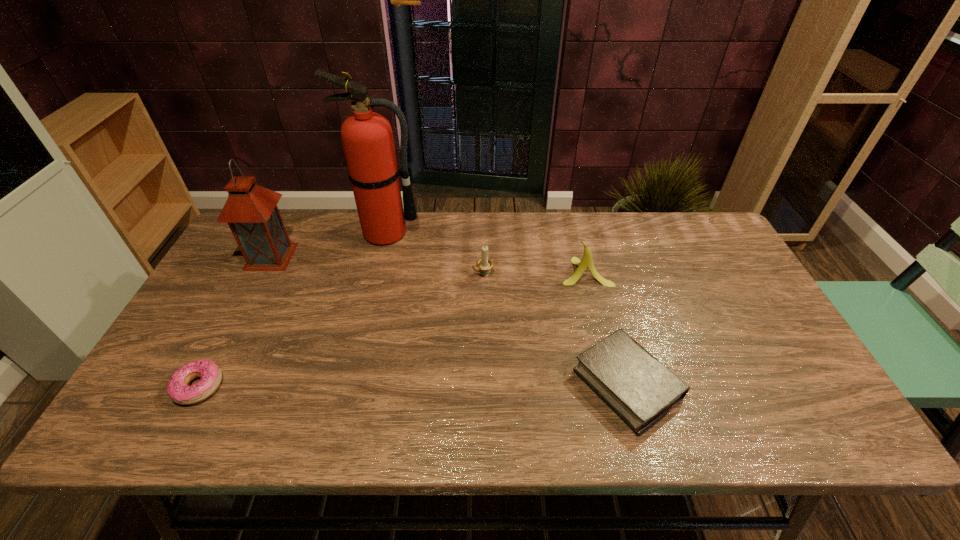
Find the location of a particular element. This screenshot has width=960, height=540. lantern at the left edge is located at coordinates (251, 211).

I want to click on doughnut that is at the left edge, so click(x=177, y=388).

Locate an element on the screen. object that is at the far left corner is located at coordinates (251, 211).

Where is `object present at the near left corner`? The image size is (960, 540). object present at the near left corner is located at coordinates (177, 388).

This screenshot has width=960, height=540. What are the coordinates of `free spot at the far edge of the desktop` in the screenshot? It's located at (555, 219).

You are a GUI agent. You are given a task and a screenshot of the screen. Output one action in this format:
    pyautogui.click(x=<x>, y=<y>)
    Task: Click on the free space at the near edge of the desktop
    The height and width of the screenshot is (540, 960).
    Given the screenshot: What is the action you would take?
    pyautogui.click(x=249, y=433)

The height and width of the screenshot is (540, 960). I want to click on vacant area at the left edge, so click(246, 284).

Image resolution: width=960 pixels, height=540 pixels. I want to click on free point at the far right corner, so click(725, 255).

Find the location of `vacant space at the near right corner of the desktop`. vacant space at the near right corner of the desktop is located at coordinates (786, 421).

Identify the location of unoccupied area between the fifth tallest object and the fourth object from left to right. (555, 330).